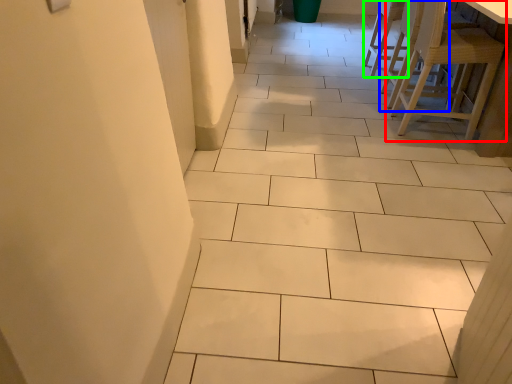
Question: Which object is the farthest from chair (highlighted by a red box)? Choose among these: chair (highlighted by a blue box) or chair (highlighted by a green box).

Choices:
 (A) chair
 (B) chair

Answer: (B)